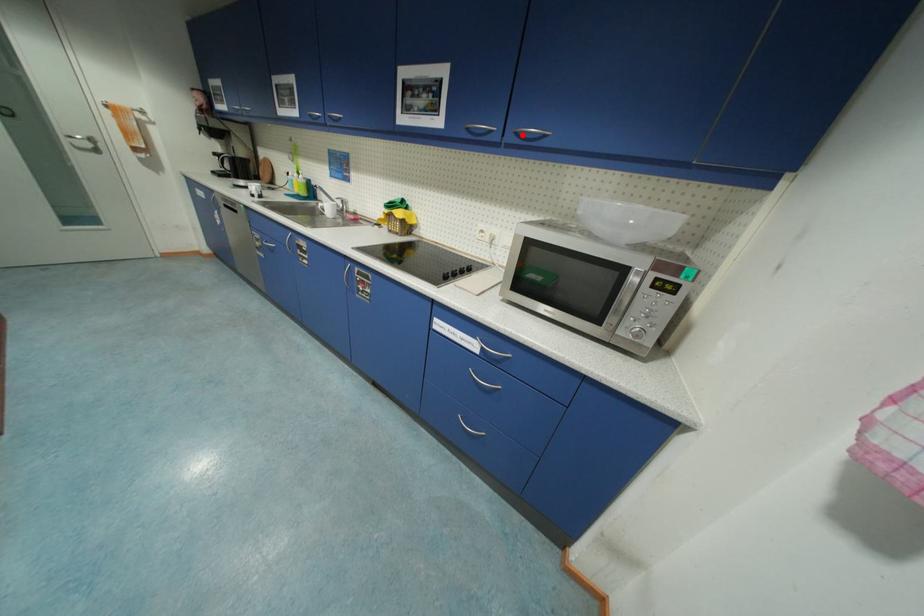
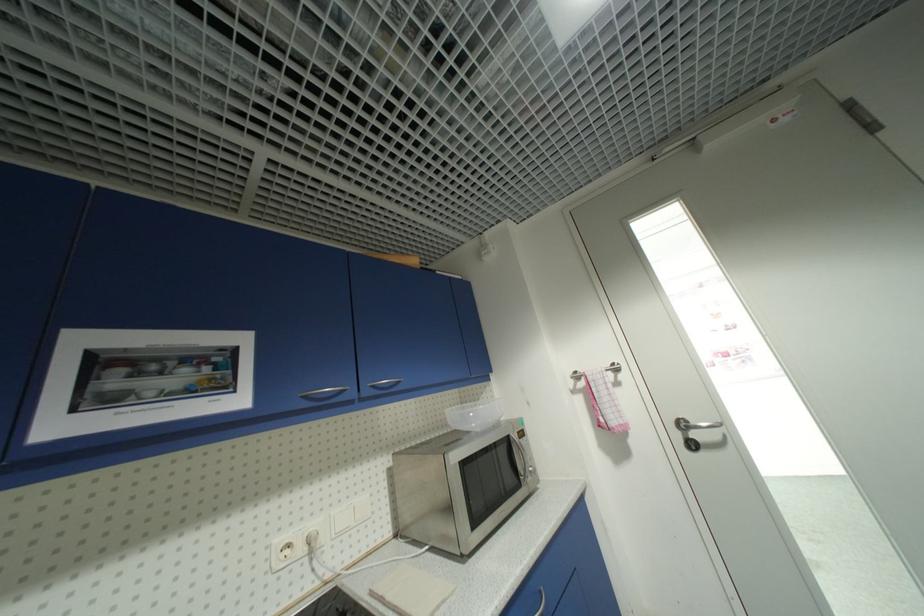
Question: I am providing you with two images of the same scene from different viewpoints. A red point is marked on the first image. Can you still see the location of the red point in image 2?

Choices:
 (A) Yes
 (B) No

Answer: (A)